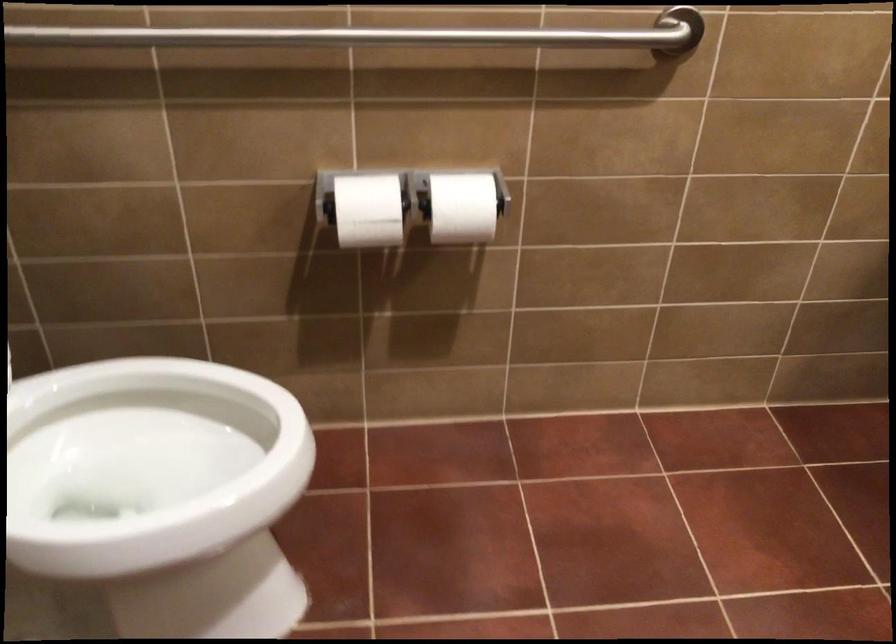
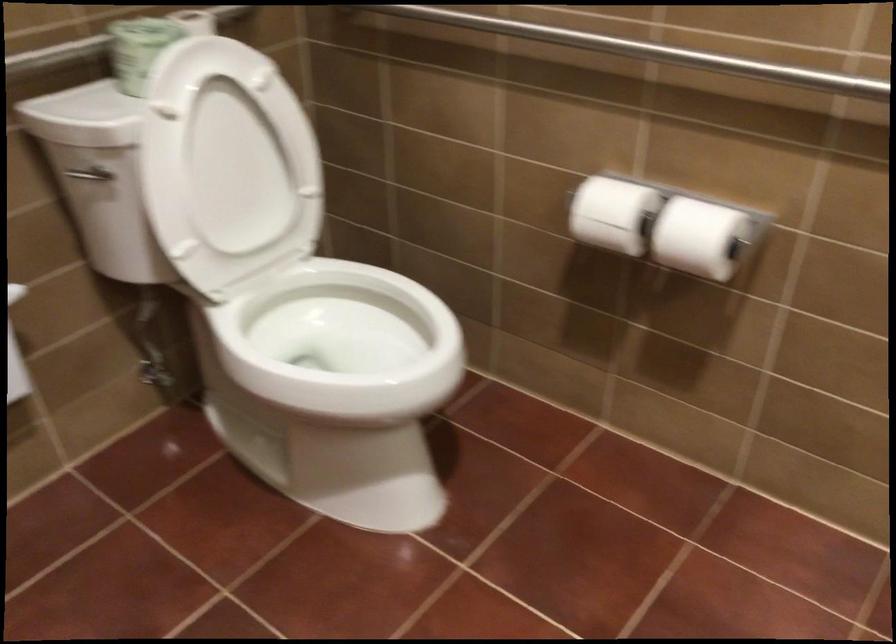
Question: The first image is from the beginning of the video and the second image is from the end. How did the camera likely rotate when shooting the video?

Choices:
 (A) Left
 (B) Right
 (C) Up
 (D) Down

Answer: (A)